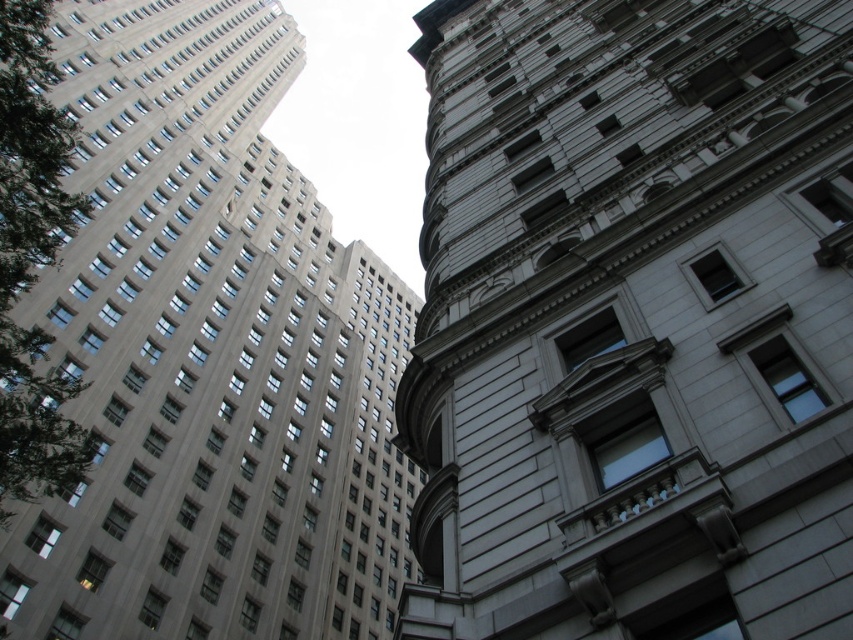
Question: Is white stone building at center positioned in front of gray stone building at upper left?

Choices:
 (A) no
 (B) yes

Answer: (B)

Question: Which point is farther to the camera?

Choices:
 (A) (639, 68)
 (B) (267, 84)

Answer: (B)

Question: Which point is farther from the camera taking this photo?

Choices:
 (A) (572, 449)
 (B) (215, 428)

Answer: (B)

Question: Can you confirm if white stone building at center is thinner than gray stone building at upper left?

Choices:
 (A) yes
 (B) no

Answer: (A)

Question: Is white stone building at center bigger than gray stone building at upper left?

Choices:
 (A) yes
 (B) no

Answer: (B)